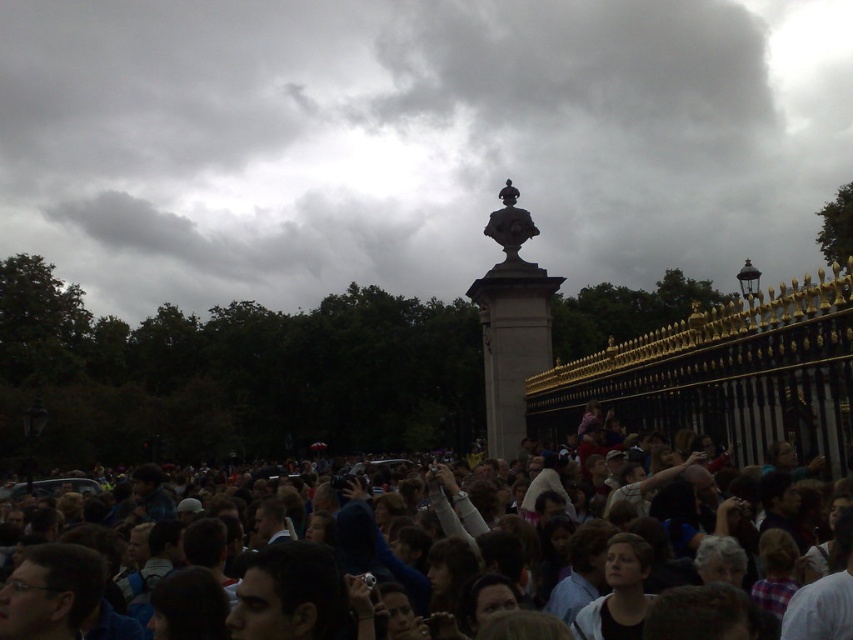
Question: Considering the relative positions of dark stone column at center and dark gray crowd at center in the image provided, where is dark stone column at center located with respect to dark gray crowd at center?

Choices:
 (A) right
 (B) left

Answer: (A)

Question: Among these points, which one is nearest to the camera?

Choices:
 (A) (445, 8)
 (B) (363, 524)

Answer: (B)

Question: Can you confirm if dark stone column at center is positioned below dark gray crowd at center?

Choices:
 (A) yes
 (B) no

Answer: (B)

Question: Is the position of dark stone column at center more distant than that of dark gray crowd at center?

Choices:
 (A) yes
 (B) no

Answer: (A)